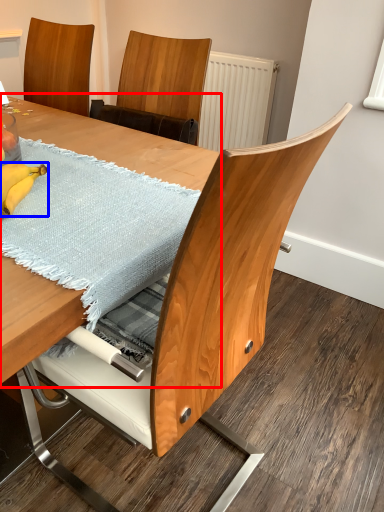
Question: Which object appears closest to the camera in this image, table (highlighted by a red box) or banana (highlighted by a blue box)?

Choices:
 (A) table
 (B) banana

Answer: (A)